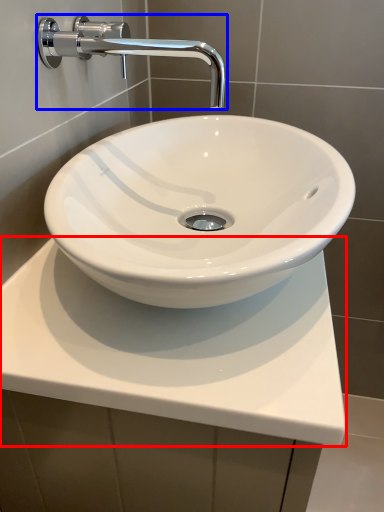
Question: Which point is closer to the camera, counter top (highlighted by a red box) or tap (highlighted by a blue box)?

Choices:
 (A) counter top
 (B) tap

Answer: (A)